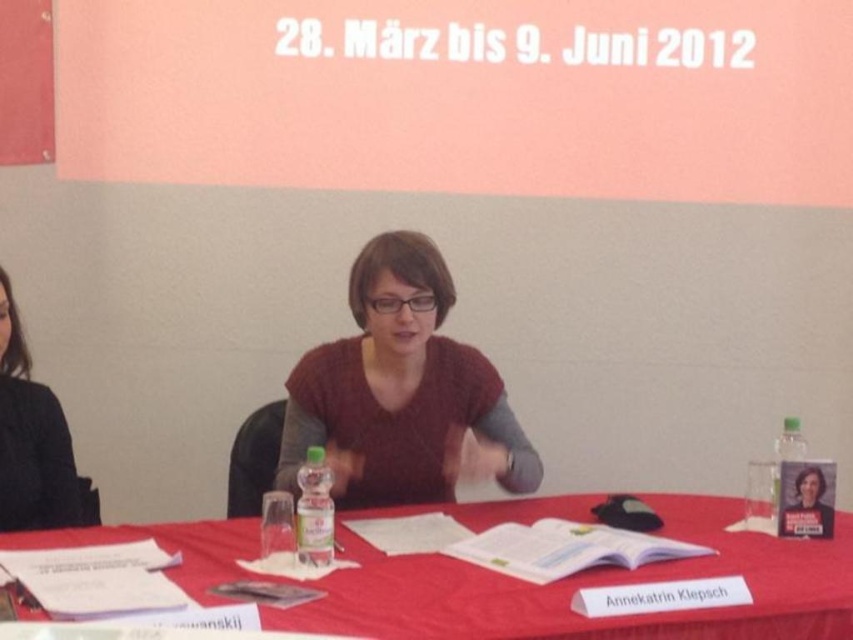
Between matte brown sweater at center and clear plastic bottle at right, which one appears on the right side from the viewer's perspective?

From the viewer's perspective, clear plastic bottle at right appears more on the right side.

Is matte brown sweater at center smaller than clear plastic bottle at right?

Actually, matte brown sweater at center might be larger than clear plastic bottle at right.

Who is more distant from viewer, (390, 292) or (776, 500)?

Point (390, 292)

The width and height of the screenshot is (853, 640). I want to click on matte brown sweater at center, so click(x=401, y=392).

Between black fabric hair at left and clear plastic bottle at right, which one is positioned lower?

clear plastic bottle at right is below.

Does point (0, 442) lie in front of point (796, 436)?

No, it is not.

Is point (25, 372) less distant than point (796, 444)?

That is False.

Locate an element on the screen. black fabric hair at left is located at coordinates (32, 440).

Is matte brown sweater at center taller than black fabric hair at left?

Indeed, matte brown sweater at center has a greater height compared to black fabric hair at left.

Which is below, matte brown sweater at center or black fabric hair at left?

Positioned lower is black fabric hair at left.

Is point (416, 250) closer to camera compared to point (39, 435)?

Yes, it is in front of point (39, 435).

This screenshot has height=640, width=853. Identify the location of matte brown sweater at center. (401, 392).